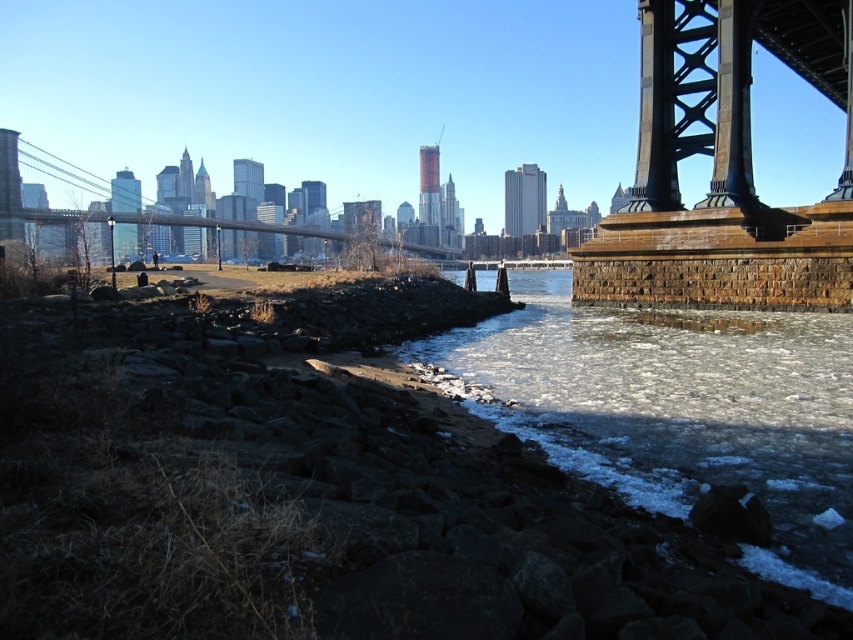
You are standing at the rocky shoreline in the image and want to cross to the bridge on the right. There is frozen ice at lower left at point (676, 410). Can you safely step onto the frozen ice at lower left to reach the bridge?

The frozen ice at lower left is located at point (676, 410), so yes, you can step onto it to reach the bridge since it is positioned between the shoreline and the bridge.

You are a delivery drone that needs to land on either the frozen ice at lower left or the metallic gray suspension bridge at left. Which surface is safer for landing based on their thickness?

The metallic gray suspension bridge at left is safer for landing because the frozen ice at lower left is thinner than it.

You are standing on the rocky shoreline and want to cross to the other side of the water. The metallic gray suspension bridge at left is partially submerged. Can you use the frozen ice at lower left to reach the bridge?

The frozen ice at lower left is to the right of the metallic gray suspension bridge at left, so you can walk across the ice towards the bridge to reach it.